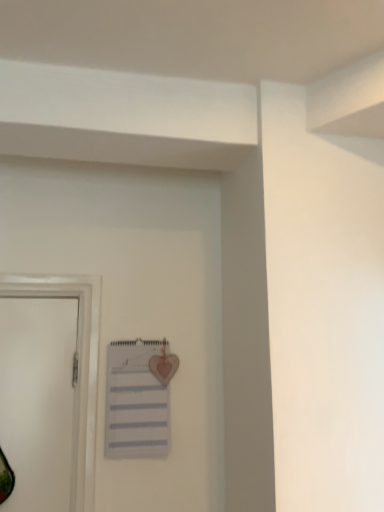
Find the location of a particular element. white lined notebook at center is located at coordinates (138, 399).

This screenshot has width=384, height=512. Describe the element at coordinates (138, 399) in the screenshot. I see `white lined notebook at center` at that location.

Locate an element on the screen. The height and width of the screenshot is (512, 384). white lined notebook at center is located at coordinates (138, 399).